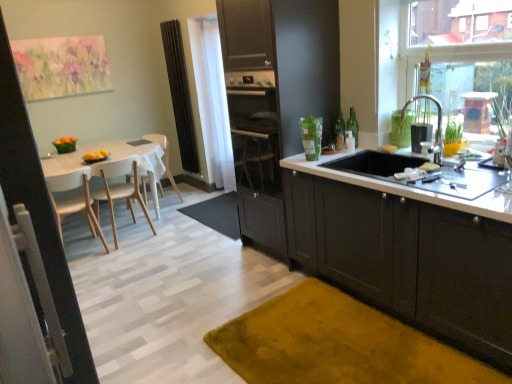
Identify the location of free location in front of green glass bottle at upper right, placed as the 2th bottle when sorted from left to right. The width and height of the screenshot is (512, 384). coord(355,148).